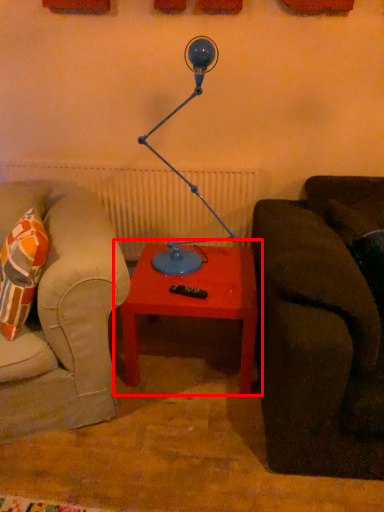
Question: From the image, what is the correct spatial relationship of table (annotated by the red box) in relation to table lamp?

Choices:
 (A) right
 (B) left

Answer: (A)